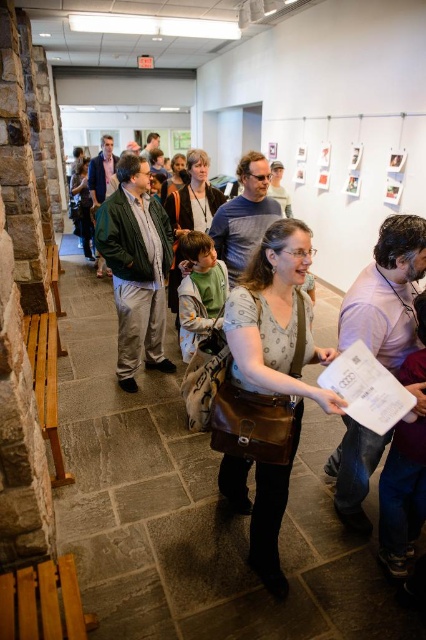
You are a security guard at the gallery and need to ensure that the matte brown bag at center and the green matte jacket at center can both fit through a narrow doorway that is 1 meter wide. Based on their sizes, can both items pass through the doorway together?

The matte brown bag at center is narrower than the green matte jacket at center. Since the green matte jacket at center is wider, and the doorway is 1 meter wide, if the green matte jacket at center can pass through, then the matte brown bag at center can also pass. However, without knowing the exact width of the green matte jacket at center, we cannot definitively confirm if both can fit together through the 1 meter doorway.

You are standing at the entrance of the gallery and see two points marked in the image. The first point is at coordinates point (271,266) and the second is at point (175,368). If you want to reach the second point without passing through the first, which direction should you move relative to the first point?

To reach the second point at point (175,368) without passing through the first point at point (271,266), you should move towards the upper right direction relative to the first point.

You are at an art exhibition and see a woman holding a booklet. Next to her, there is a matte brown bag at center and a green matte jacket at center. Which object is positioned to the right of the other?

The matte brown bag at center is to the right of the green matte jacket at center.